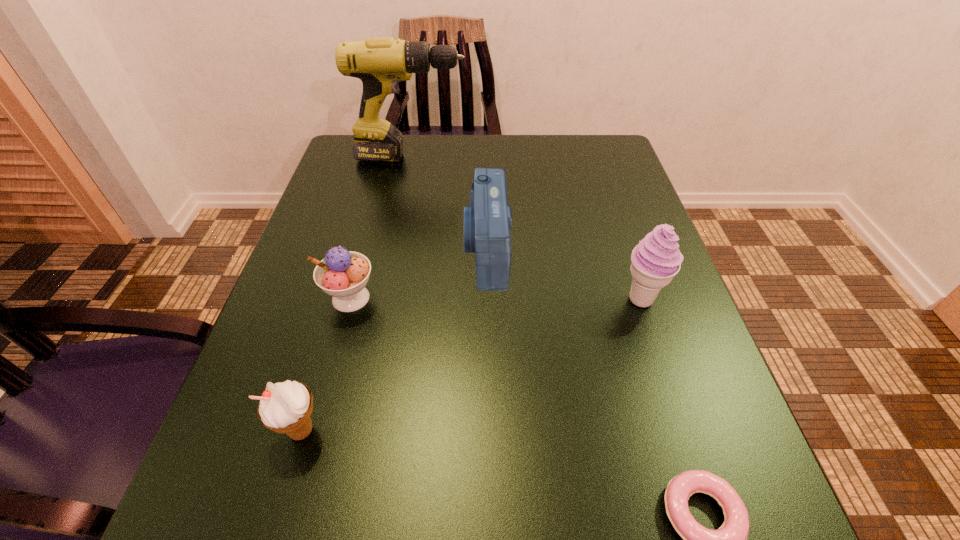
Where is `free space located 0.230m on the lens of the fourth object from left to right`? The height and width of the screenshot is (540, 960). free space located 0.230m on the lens of the fourth object from left to right is located at coordinates (348, 250).

Identify the location of free space located 0.280m on the right of the second nearest object. This screenshot has width=960, height=540. (525, 430).

I want to click on object present at the far edge, so click(380, 63).

You are a GUI agent. You are given a task and a screenshot of the screen. Output one action in this format:
    pyautogui.click(x=<x>, y=<y>)
    Task: Click on the drill that is at the left edge
    The height and width of the screenshot is (540, 960).
    Given the screenshot: What is the action you would take?
    pyautogui.click(x=380, y=63)

The image size is (960, 540). Identify the location of object at the right edge. (655, 261).

You are a GUI agent. You are given a task and a screenshot of the screen. Output one action in this format:
    pyautogui.click(x=<x>, y=<y>)
    Task: Click on the object that is at the far left corner
    This screenshot has width=960, height=540.
    Given the screenshot: What is the action you would take?
    pyautogui.click(x=380, y=63)

Identify the location of vacant space at the near edge of the desktop. (567, 508).

Identify the location of vacant area at the left edge. [354, 218].

In the image, there is a desktop. In order to click on vacant region at the right edge in this screenshot , I will do `click(617, 314)`.

I want to click on vacant area at the far left corner, so click(x=364, y=164).